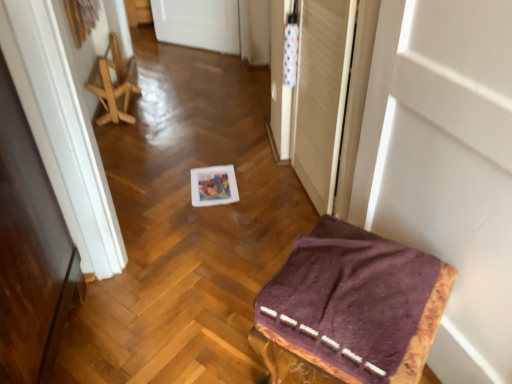
I want to click on free space to the left of purple fabric-covered stool at lower right, which appears as the 1th furniture when ordered from the bottom, so click(x=207, y=334).